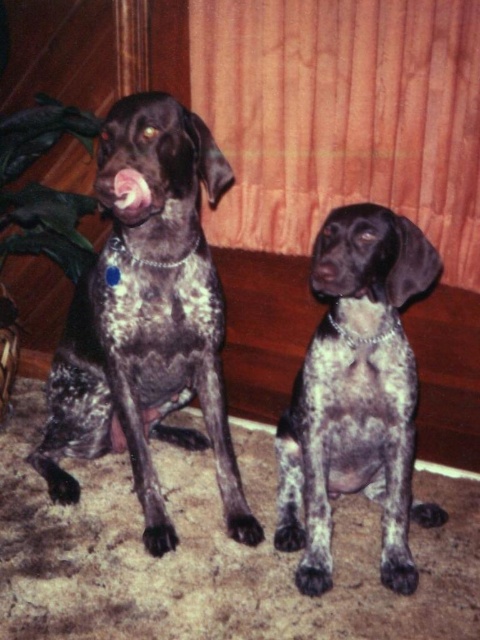
Based on the photo, you are a photographer standing in the room where the speckled fur dog at center is sitting. You want to take a closeup photo of the dog without getting too close. What is the minimum distance you need to maintain between yourself and the dog to capture the closeup?

The minimum distance you need to maintain between yourself and the speckled fur dog at center is 1.34 meters to capture the closeup.

You are a dog trainer assessing the size of two dogs in the image. You need to determine which one is bigger. The dogs are the speckled fur dog at left and the speckled fur dog at center. Which one is larger?

The speckled fur dog at left is larger in size than the speckled fur dog at center according to the description.